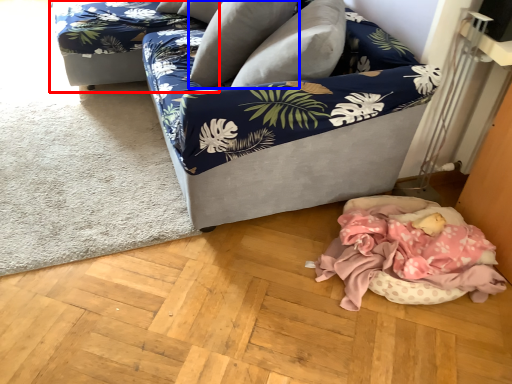
Question: Which of the following is the closest to the observer, couch (highlighted by a red box) or pillow (highlighted by a blue box)?

Choices:
 (A) couch
 (B) pillow

Answer: (B)